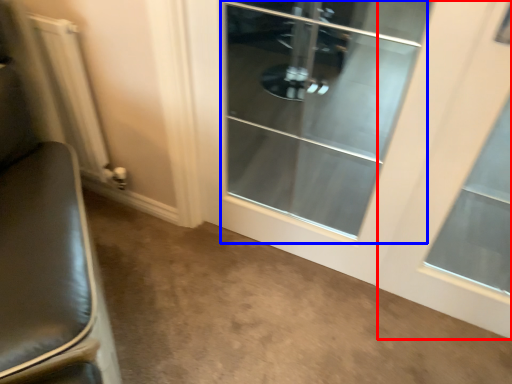
Question: Which of the following is the farthest to the observer, window (highlighted by a red box) or screen door (highlighted by a blue box)?

Choices:
 (A) window
 (B) screen door

Answer: (B)